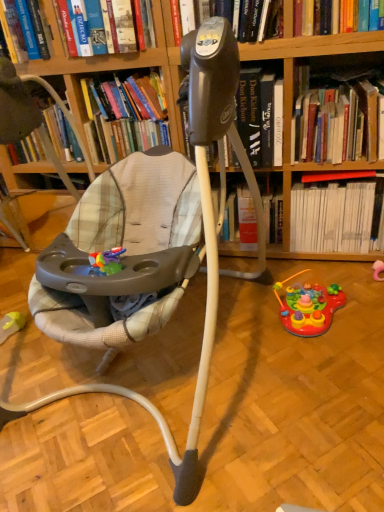
Locate an element on the screen. The height and width of the screenshot is (512, 384). vacant space behind rubberized plastic activity center at lower right, the 2th toy positioned from the left is located at coordinates (294, 274).